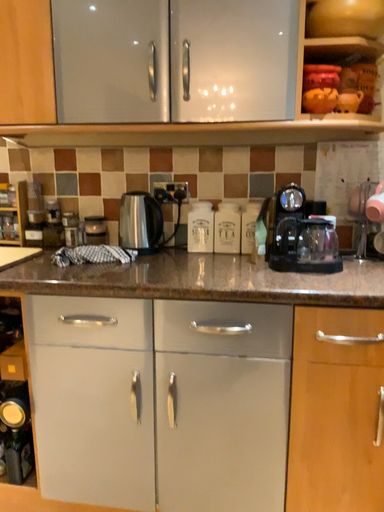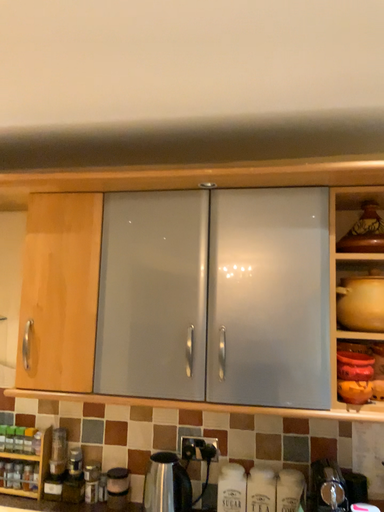
Question: Which way did the camera rotate in the video?

Choices:
 (A) rotated downward
 (B) rotated upward

Answer: (B)